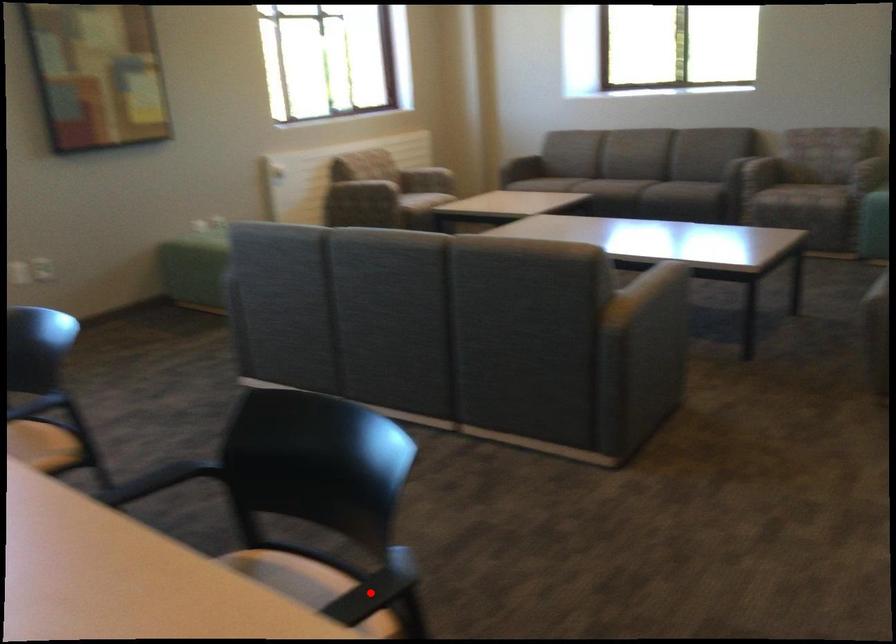
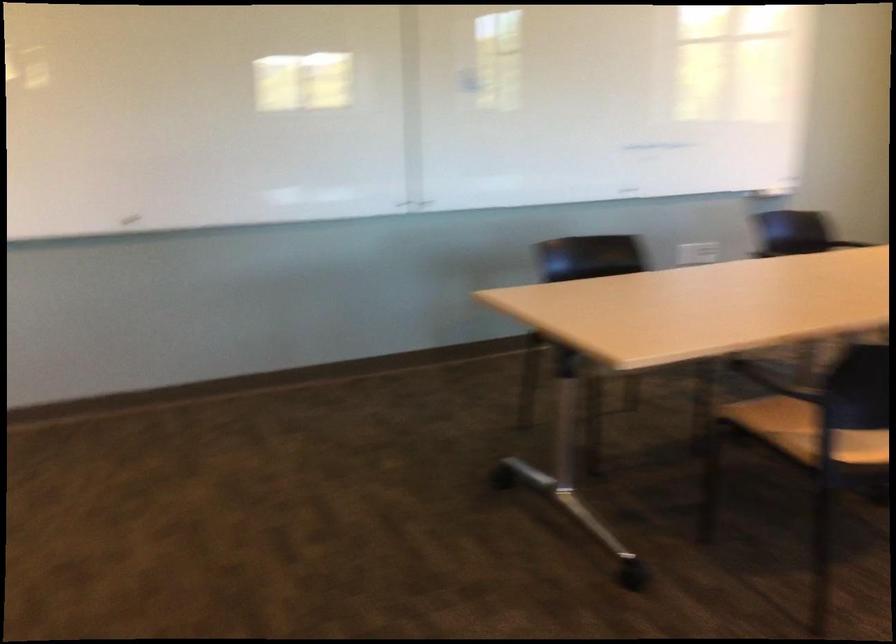
Question: I am providing you with two images of the same scene from different viewpoints. A red point is marked on the first image. At the location where the point appears in image 1, is it still visible in image 2?

Choices:
 (A) Yes
 (B) No

Answer: (B)